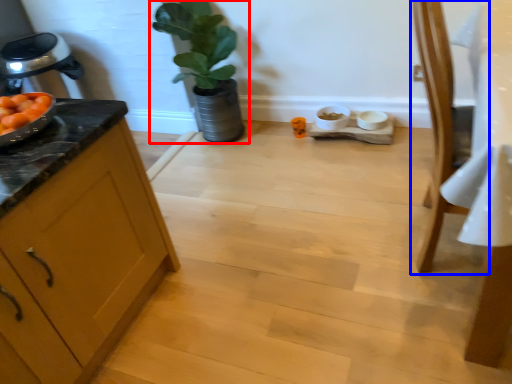
Question: Which point is further to the camera, houseplant (highlighted by a red box) or chair (highlighted by a blue box)?

Choices:
 (A) houseplant
 (B) chair

Answer: (A)